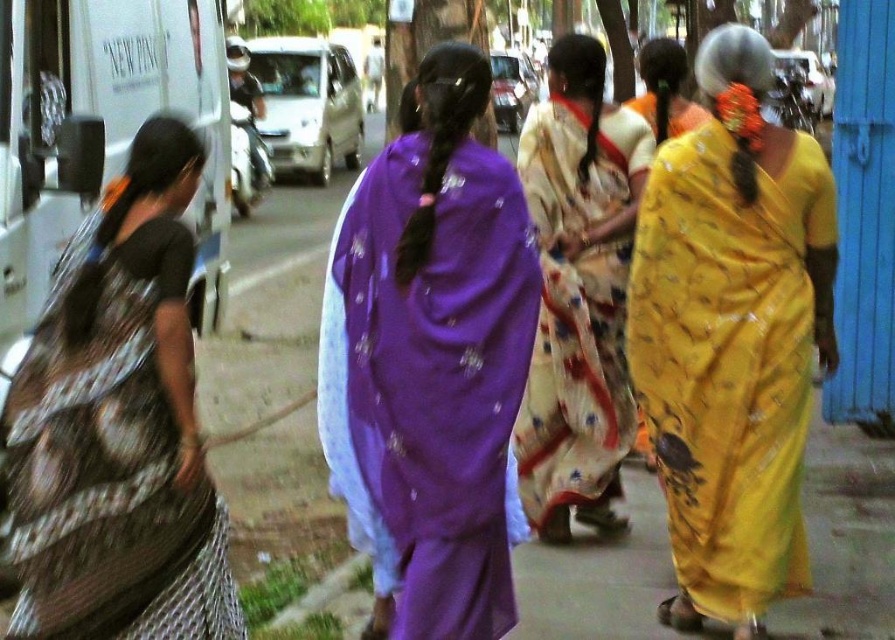
You are a photographer trying to capture a photo of the two women wearing the printed fabric saree at left and the printed silk sari at center. Since you want both in the frame, which direction should you move to ensure both are visible?

You should move to the right to ensure both the printed fabric saree at left and the printed silk sari at center are visible in the frame since the printed fabric saree at left is to the left of the printed silk sari at center.

In the scene shown: You are a photographer trying to capture the group of women in the scene. You notice the printed fabric saree at left and the printed silk sari at center. Which one should you focus on if you want to photograph the larger garment?

The printed silk sari at center is larger than the printed fabric saree at left, so you should focus on the printed silk sari at center for the larger garment.